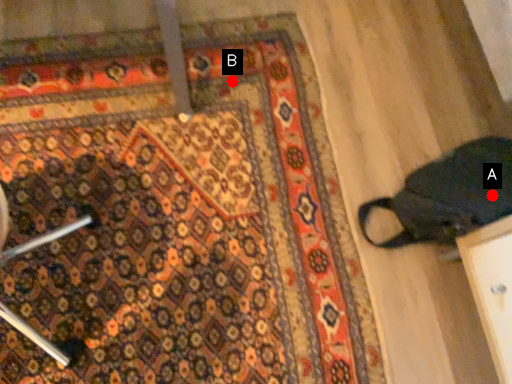
Question: Two points are circled on the image, labeled by A and B beside each circle. Which point is closer to the camera taking this photo?

Choices:
 (A) A is closer
 (B) B is closer

Answer: (A)